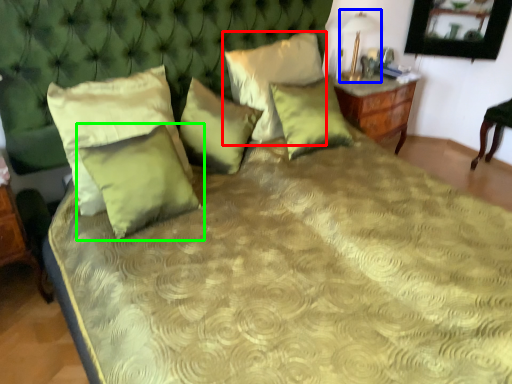
Question: Based on their relative distances, which object is nearer to pillow (highlighted by a red box)? Choose from table lamp (highlighted by a blue box) and pillow (highlighted by a green box).

Choices:
 (A) table lamp
 (B) pillow

Answer: (A)